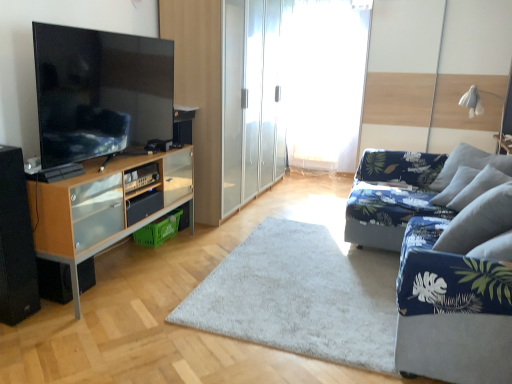
Question: Is point (5, 307) positioned closer to the camera than point (51, 51)?

Choices:
 (A) farther
 (B) closer

Answer: (A)

Question: In the image, is black matte speaker at lower left, the first speaker when ordered from front to back, positioned in front of or behind matte black tv at left?

Choices:
 (A) front
 (B) behind

Answer: (A)

Question: Which is farther from the transparent glass wardrobe at center?

Choices:
 (A) black matte speaker at lower left, which is counted as the 2th speaker, starting from the front
 (B) wooden cabinet at left
 (C) white soft rug at center
 (D) black matte speaker at lower left, the 2th speaker when ordered from back to front
 (E) gray fabric pillow at right

Answer: (E)

Question: Which of these objects is positioned closest to the wooden cabinet at left?

Choices:
 (A) white sheer curtain at center
 (B) white soft rug at center
 (C) black matte speaker at lower left, marked as the first speaker in a back-to-front arrangement
 (D) black matte speaker at lower left, the 2th speaker when ordered from back to front
 (E) blue fabric couch at right

Answer: (C)